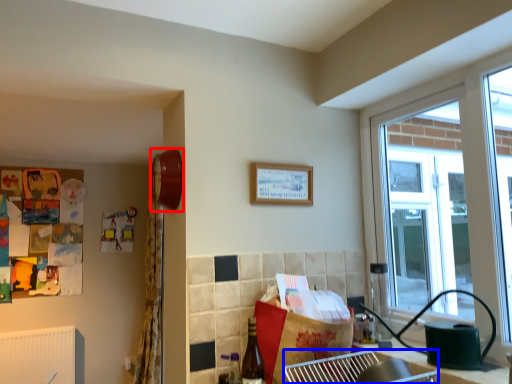
Question: Which point is closer to the camera, clock (highlighted by a red box) or cabinetry (highlighted by a blue box)?

Choices:
 (A) clock
 (B) cabinetry

Answer: (B)